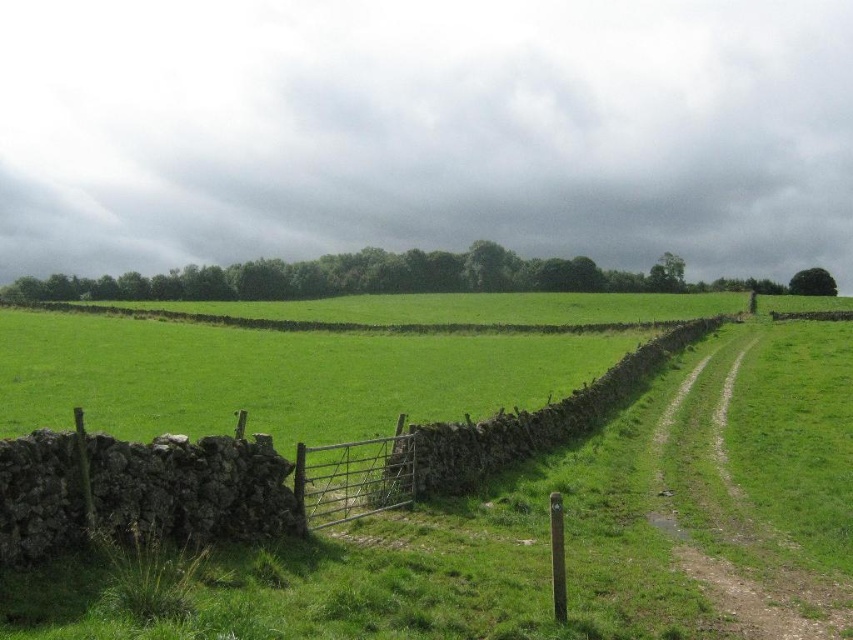
You are a hiker trying to navigate through the rural landscape. You see the dusty gravel path at right and the stone wall at center. Which object is located closer to the ground?

The dusty gravel path at right is positioned under the stone wall at center, so it is closer to the ground.

You are a hiker trying to decide whether to take the dusty gravel path at right or the stone wall at center as your path forward. Which option is narrower and thus more suitable for a narrow backpack?

The dusty gravel path at right is smaller than the stone wall at center, so it is narrower and more suitable for a narrow backpack.